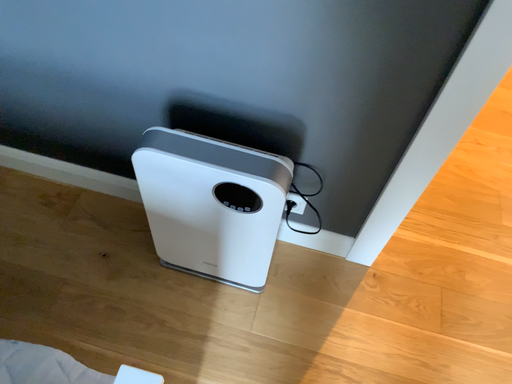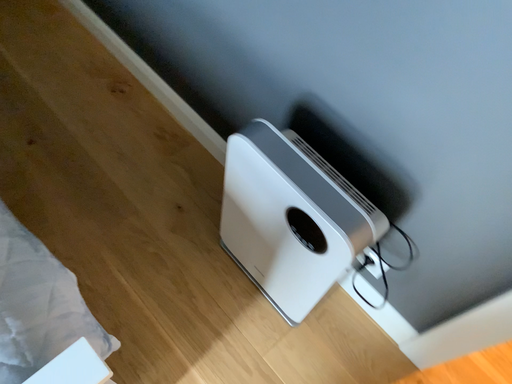
Question: Which way did the camera rotate in the video?

Choices:
 (A) rotated right
 (B) rotated left

Answer: (B)